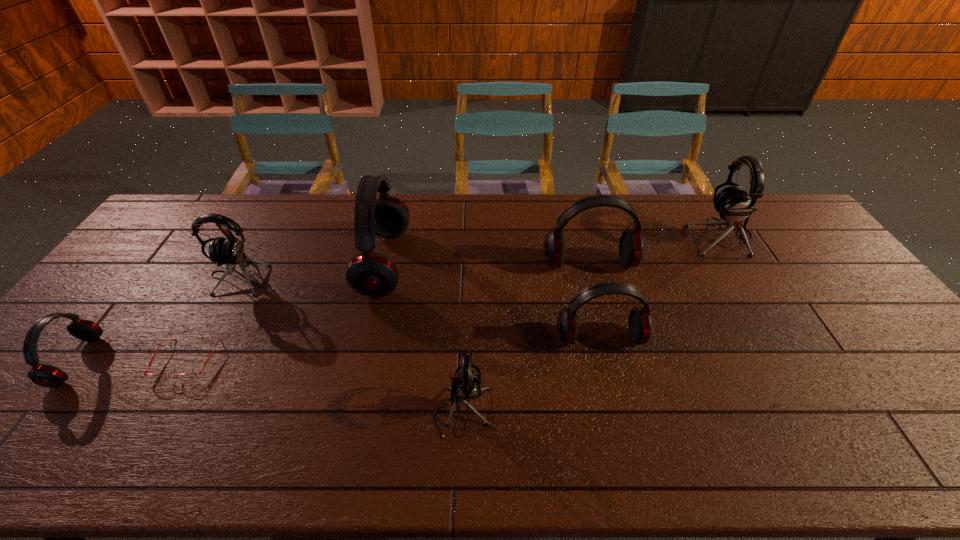
Find the location of `unoccupied position between the second black earphone from right to left and the spectacles`. unoccupied position between the second black earphone from right to left and the spectacles is located at coordinates (324, 386).

What are the coordinates of `vacant space in between the smallest red earphone and the fifth object from right to left` in the screenshot? It's located at (230, 312).

Where is `empty location between the shortest object and the third biggest red earphone`? The height and width of the screenshot is (540, 960). empty location between the shortest object and the third biggest red earphone is located at coordinates (x=394, y=349).

Find the location of `free point between the shortest object and the third smallest red earphone`. free point between the shortest object and the third smallest red earphone is located at coordinates (388, 312).

In order to click on free space between the third smallest red earphone and the leftmost object in this screenshot , I will do `click(333, 312)`.

Identify the location of vacant space that's between the biggest red earphone and the third biggest red earphone. (492, 300).

I want to click on blank region between the fifth object from right to left and the smallest black earphone, so click(423, 338).

Select which object is the second closest to the biggest black earphone. Please provide its 2D coordinates. Your answer should be formatted as a tuple, i.e. [(x, y)], where the tuple contains the x and y coordinates of a point satisfying the conditions above.

[(640, 325)]

At what (x,y) coordinates should I click in order to perform the action: click on object that is the fourth closest to the fourth earphone from right to left. Please return your answer as a coordinate pair (x, y). This screenshot has height=540, width=960. Looking at the image, I should click on (182, 377).

Find the location of a particular element. The height and width of the screenshot is (540, 960). the closest earphone to the leftmost red earphone is located at coordinates tap(230, 250).